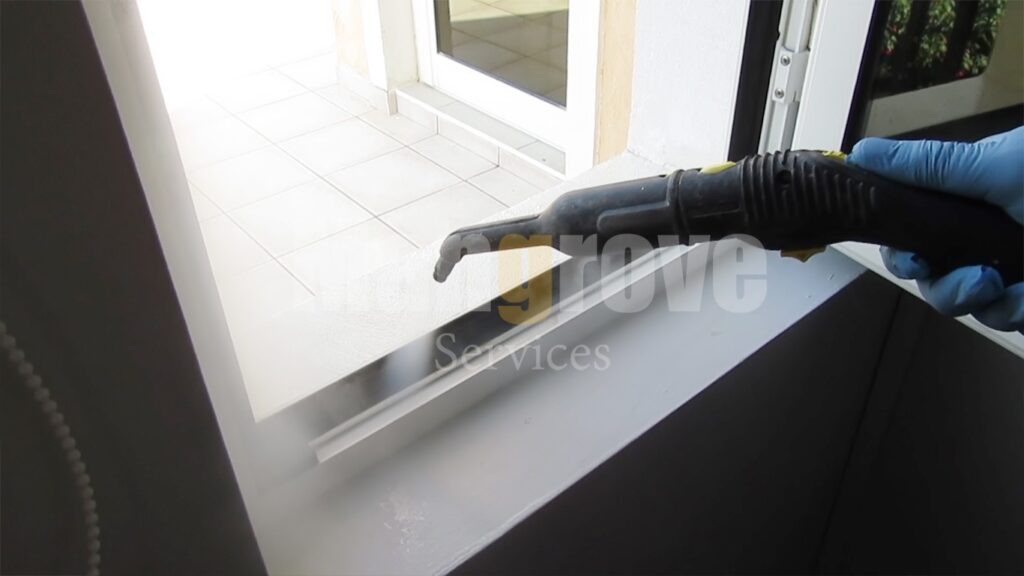
Image resolution: width=1024 pixels, height=576 pixels. Find the location of `window`. window is located at coordinates point(325,209).